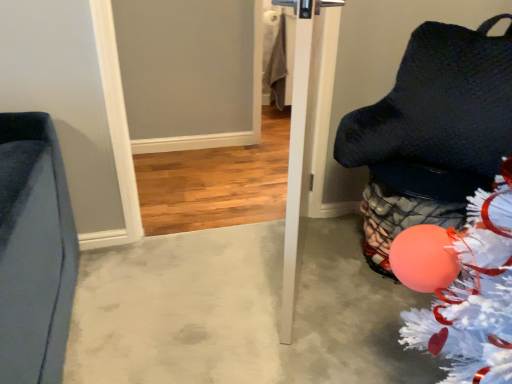
This screenshot has width=512, height=384. I want to click on vacant space that is to the left of white smooth door at center, so click(x=179, y=290).